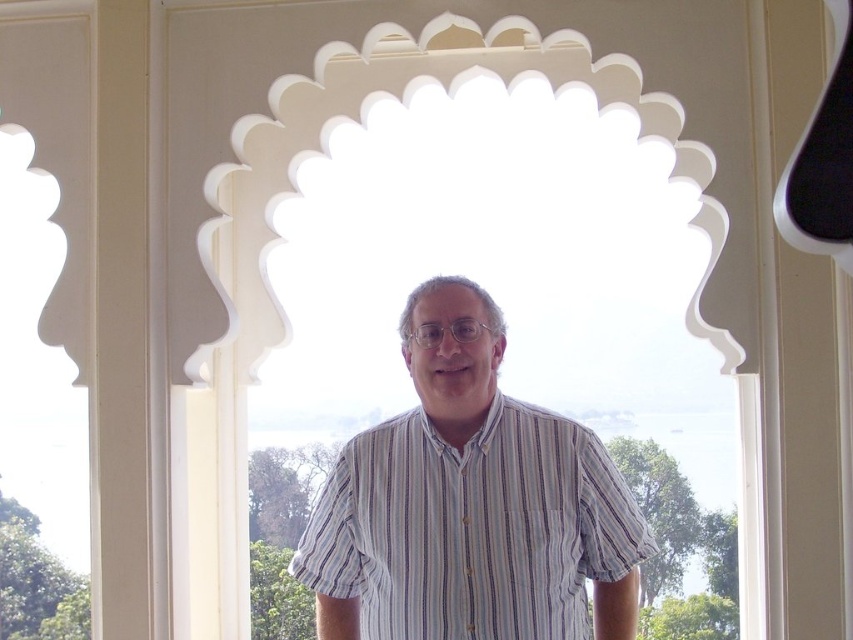
Image resolution: width=853 pixels, height=640 pixels. Describe the element at coordinates (399, 97) in the screenshot. I see `white matte window at center` at that location.

Can you confirm if white matte window at center is shorter than striped cotton shirt at center?

Incorrect, white matte window at center's height does not fall short of striped cotton shirt at center's.

Identify the location of white matte window at center. This screenshot has height=640, width=853. (399, 97).